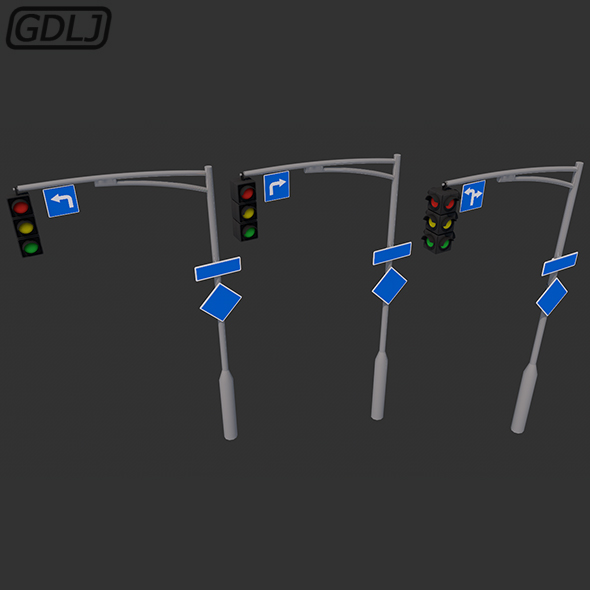
Locate an element on the screen. This screenshot has height=590, width=590. matching light is located at coordinates (242, 196), (244, 222), (19, 206), (27, 236).